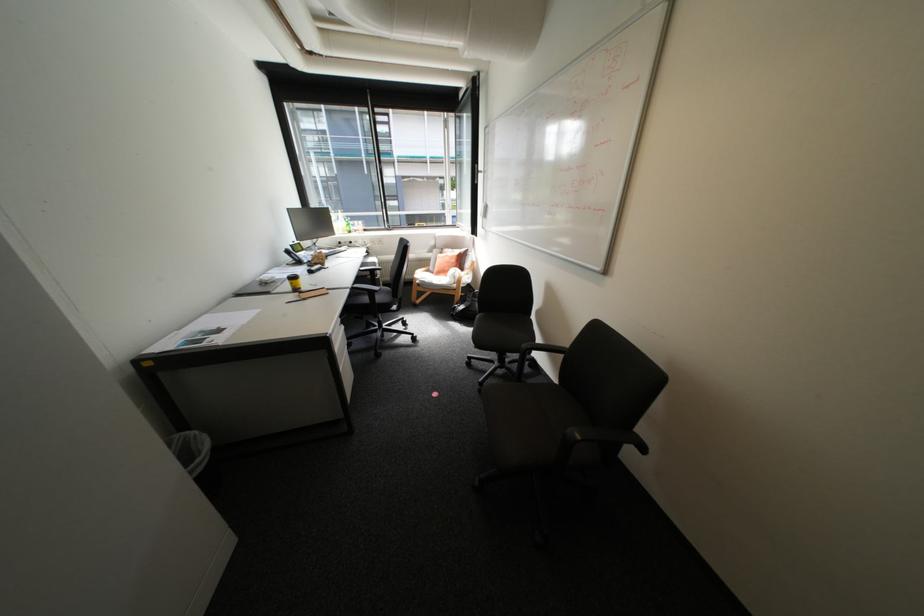
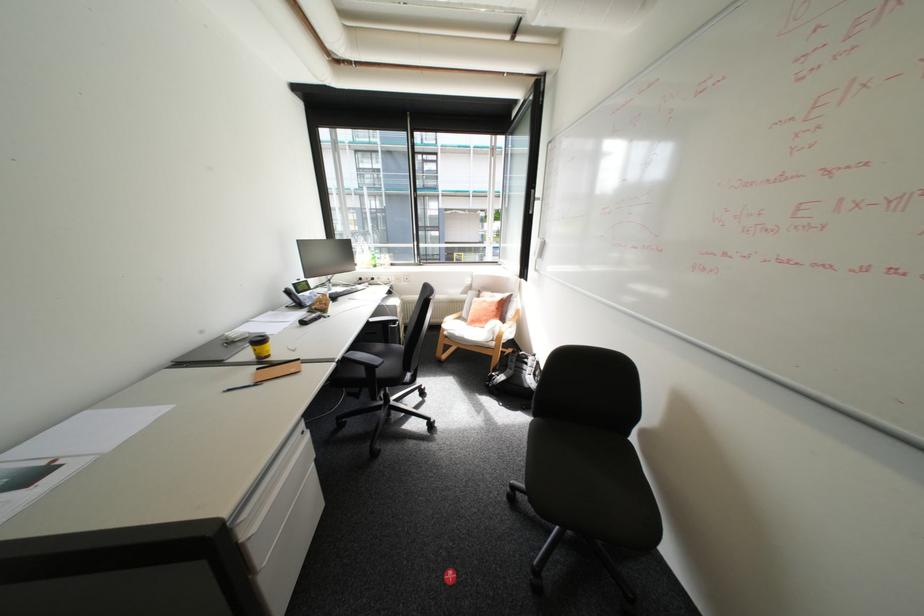
Question: How did the camera likely rotate?

Choices:
 (A) Left
 (B) Right
 (C) Up
 (D) Down

Answer: (A)